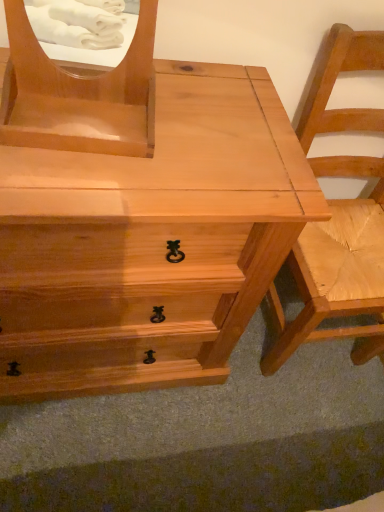
Question: From the image's perspective, is natural wood chair at right above or below natural wood chest of drawers at center?

Choices:
 (A) above
 (B) below

Answer: (A)

Question: Is natural wood chair at right spatially inside natural wood chest of drawers at center, or outside of it?

Choices:
 (A) outside
 (B) inside

Answer: (A)

Question: Estimate the real-world distances between objects in this image. Which object is closer to the natural wood chest of drawers at center?

Choices:
 (A) matte wood mirror at upper left
 (B) natural wood chair at right

Answer: (A)

Question: Based on their relative distances, which object is nearer to the natural wood chair at right?

Choices:
 (A) matte wood mirror at upper left
 (B) natural wood chest of drawers at center

Answer: (B)